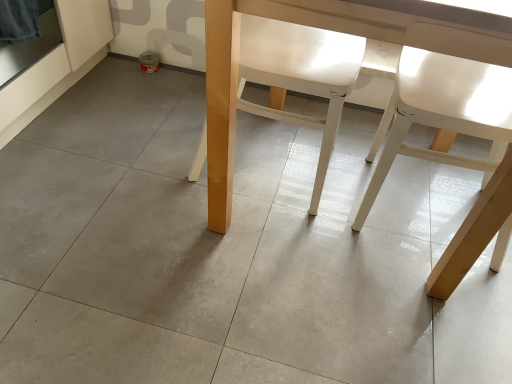
Question: Is white matte chair at right, which appears as the 1th chair when viewed from the right, taller than matte wood table at center?

Choices:
 (A) no
 (B) yes

Answer: (A)

Question: From the image's perspective, is white matte chair at right, which appears as the 1th chair when viewed from the right, below matte wood table at center?

Choices:
 (A) yes
 (B) no

Answer: (A)

Question: From a real-world perspective, is white matte chair at right, the second chair positioned from the left, under matte wood table at center?

Choices:
 (A) no
 (B) yes

Answer: (B)

Question: Can matte wood table at center be found inside white matte chair at right, the second chair positioned from the left?

Choices:
 (A) no
 (B) yes

Answer: (A)

Question: From the image's perspective, is white matte chair at right, which appears as the 1th chair when viewed from the right, located above matte wood table at center?

Choices:
 (A) yes
 (B) no

Answer: (B)

Question: From a real-world perspective, is matte wood table at center positioned above or below white matte chair at center, marked as the first chair in a left-to-right arrangement?

Choices:
 (A) above
 (B) below

Answer: (A)

Question: Is matte wood table at center taller or shorter than white matte chair at center, the 2th chair viewed from the right?

Choices:
 (A) tall
 (B) short

Answer: (A)

Question: Is point (470, 21) positioned closer to the camera than point (260, 29)?

Choices:
 (A) closer
 (B) farther

Answer: (A)

Question: Considering the relative positions of matte wood table at center and white matte chair at center, marked as the first chair in a left-to-right arrangement, in the image provided, is matte wood table at center to the left or to the right of white matte chair at center, marked as the first chair in a left-to-right arrangement,?

Choices:
 (A) right
 (B) left

Answer: (A)

Question: Considering the positions of white matte chair at center, the 2th chair viewed from the right, and white matte chair at right, the second chair positioned from the left, in the image, is white matte chair at center, the 2th chair viewed from the right, wider or thinner than white matte chair at right, the second chair positioned from the left,?

Choices:
 (A) thin
 (B) wide

Answer: (B)

Question: Relative to white matte chair at right, which appears as the 1th chair when viewed from the right, is white matte chair at center, marked as the first chair in a left-to-right arrangement, in front or behind?

Choices:
 (A) behind
 (B) front

Answer: (A)

Question: Based on their sizes in the image, would you say white matte chair at center, the 2th chair viewed from the right, is bigger or smaller than white matte chair at right, which appears as the 1th chair when viewed from the right?

Choices:
 (A) small
 (B) big

Answer: (B)

Question: Visually, is white matte chair at center, marked as the first chair in a left-to-right arrangement, positioned to the left or to the right of white matte chair at right, the second chair positioned from the left?

Choices:
 (A) right
 (B) left

Answer: (B)

Question: Looking at their shapes, would you say white matte chair at right, which appears as the 1th chair when viewed from the right, is wider or thinner than matte wood table at center?

Choices:
 (A) wide
 (B) thin

Answer: (B)

Question: Considering the positions of white matte chair at right, the second chair positioned from the left, and matte wood table at center in the image, is white matte chair at right, the second chair positioned from the left, taller or shorter than matte wood table at center?

Choices:
 (A) short
 (B) tall

Answer: (A)